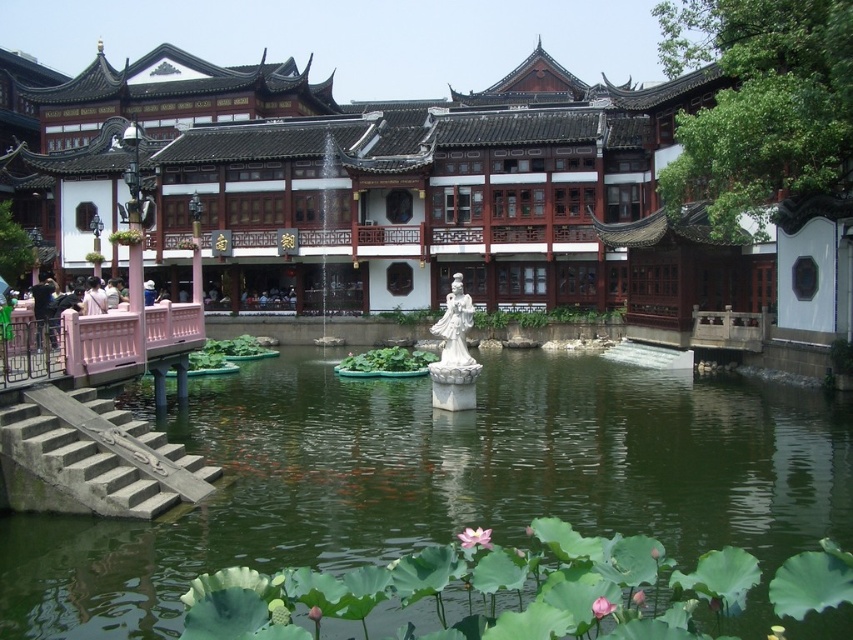
You are a visitor in the garden and want to see both the green water at center and the white marble statue at center. Which object is located lower in the scene?

The green water at center is located below the white marble statue at center, so the green water at center is lower in the scene.

You are a visitor in the garden and want to take a photo of the green water at center and the white marble statue at center. Which object appears taller in the photo?

The white marble statue at center is taller than the green water at center, so it will appear taller in the photo.

In the traditional Chinese garden scene, there are two statues at the center of the pond. One is labeled as the smooth white statue at center, and the other is the white marble statue at center. Which of these two statues is wider?

The smooth white statue at center is wider than the white marble statue at center according to the description provided.